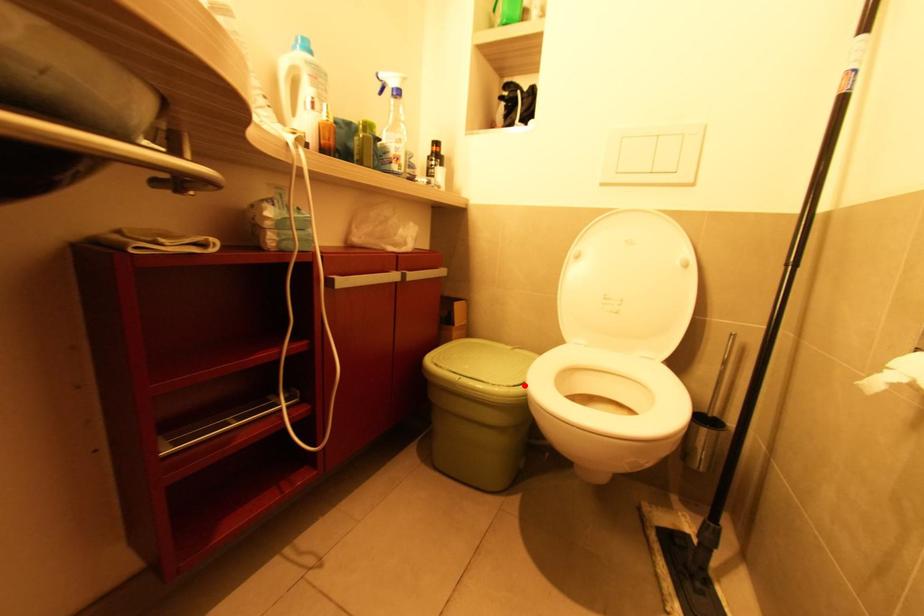
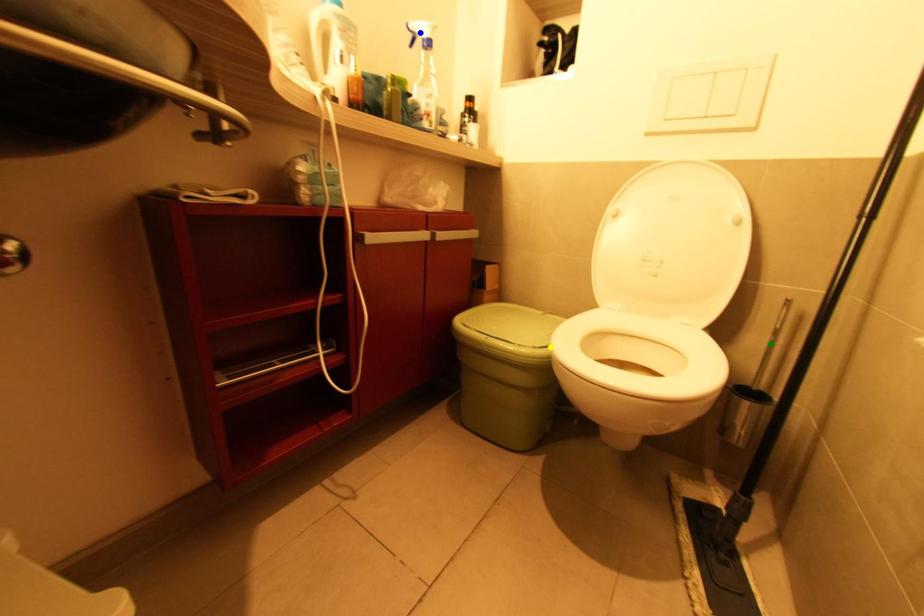
Question: I am providing you with two images of the same scene from different viewpoints. A red point is marked on the first image. You are given multiple points on the second image. Which mark in image 2 goes with the point in image 1?

Choices:
 (A) green point
 (B) blue point
 (C) yellow point

Answer: (C)